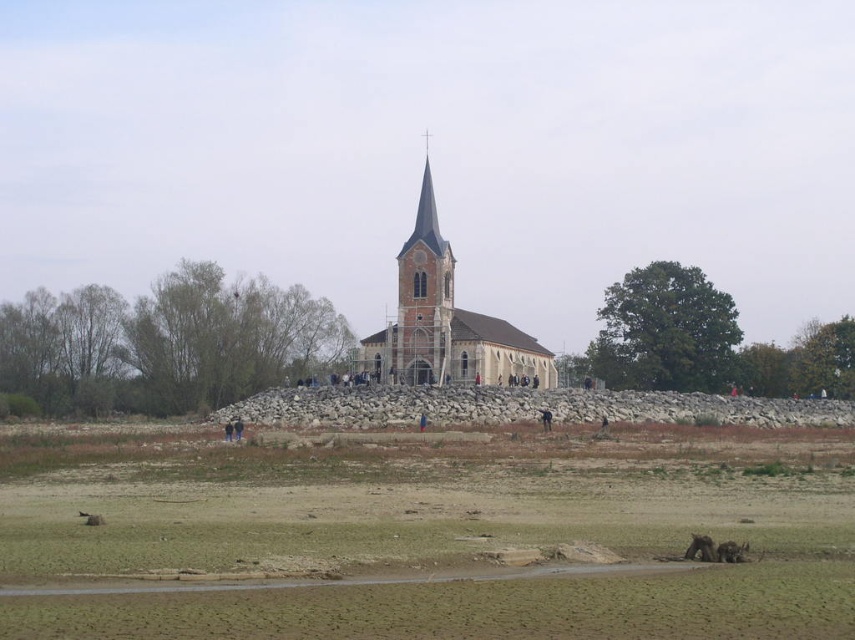
Question: Considering the relative positions of white brick church at center and brown fuzzy dog at lower right in the image provided, where is white brick church at center located with respect to brown fuzzy dog at lower right?

Choices:
 (A) above
 (B) below

Answer: (A)

Question: Can you confirm if brown dry dirt field at lower center is positioned above brown furry dog at lower right?

Choices:
 (A) no
 (B) yes

Answer: (A)

Question: Which point is farther to the camera?

Choices:
 (A) white brick church at center
 (B) brown dry dirt field at lower center
 (C) brown fuzzy dog at lower right
 (D) brown furry dog at lower right

Answer: (A)

Question: Estimate the real-world distances between objects in this image. Which object is closer to the brown furry dog at lower right?

Choices:
 (A) brown dry dirt field at lower center
 (B) white brick church at center

Answer: (A)

Question: Can you confirm if brown furry dog at lower right is thinner than brown fuzzy dog at lower right?

Choices:
 (A) no
 (B) yes

Answer: (B)

Question: Considering the real-world distances, which object is closest to the brown furry dog at lower right?

Choices:
 (A) brown dry dirt field at lower center
 (B) brown fuzzy dog at lower right

Answer: (B)